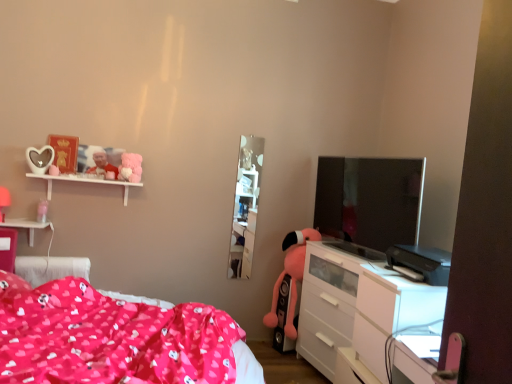
The width and height of the screenshot is (512, 384). What do you see at coordinates (357, 305) in the screenshot?
I see `white glossy chest of drawers at lower right` at bounding box center [357, 305].

Identify the location of pink plush toy at lower center, the 1th toy ordered from the bottom. The width and height of the screenshot is (512, 384). (291, 277).

In order to click on white matte shelf at upper left in this screenshot , I will do `click(85, 182)`.

At what (x,y) coordinates should I click in order to perform the action: click on white glossy tv cabinet at center. Please return your answer as a coordinate pair (x, y). The width and height of the screenshot is (512, 384). Looking at the image, I should click on (246, 206).

What do you see at coordinates (114, 338) in the screenshot?
I see `matte pink fabric bed at lower left` at bounding box center [114, 338].

The height and width of the screenshot is (384, 512). What are the coordinates of `silver glossy tv at right` in the screenshot? It's located at (369, 200).

This screenshot has width=512, height=384. Describe the element at coordinates (369, 200) in the screenshot. I see `silver glossy tv at right` at that location.

You are a GUI agent. You are given a task and a screenshot of the screen. Output one action in this format:
    pyautogui.click(x=<x>, y=<y>)
    Task: Click on the white glossy chest of drawers at lower right
    This screenshot has width=512, height=384.
    Given the screenshot: What is the action you would take?
    (357, 305)

How distant is pink plush toy at lower center, the first toy positioned from the right, from silver glossy tv at right?

pink plush toy at lower center, the first toy positioned from the right, is 26.07 inches away from silver glossy tv at right.

Is pink plush toy at lower center, the first toy positioned from the right, positioned with its back to silver glossy tv at right?

That's not correct — pink plush toy at lower center, the first toy positioned from the right, is not looking away from silver glossy tv at right.

Is the depth of pink plush toy at lower center, which is the third toy in top-to-bottom order, less than that of silver glossy tv at right?

No.

Is pink plush toy at lower center, the first toy positioned from the right, wider or thinner than silver glossy tv at right?

Clearly, pink plush toy at lower center, the first toy positioned from the right, has more width compared to silver glossy tv at right.

Considering the positions of objects white glossy tv cabinet at center and white glossy shelf at upper left in the image provided, who is more to the left, white glossy tv cabinet at center or white glossy shelf at upper left?

white glossy shelf at upper left.

Is white glossy tv cabinet at center smaller than white glossy shelf at upper left?

Yes.

From the image's perspective, relative to white glossy shelf at upper left, is white glossy tv cabinet at center above or below?

white glossy tv cabinet at center is above white glossy shelf at upper left.

From the image's perspective, relative to white matte shelf at upper left, is fluffy pink plush at upper left, which ranks as the 2th toy in top-to-bottom order, above or below?

fluffy pink plush at upper left, which ranks as the 2th toy in top-to-bottom order, is situated higher than white matte shelf at upper left in the image.

Does fluffy pink plush at upper left, which ranks as the 2th toy in left-to-right order, turn towards white matte shelf at upper left?

No.

Can you confirm if fluffy pink plush at upper left, which ranks as the second toy in bottom-to-top order, is wider than white matte shelf at upper left?

In fact, fluffy pink plush at upper left, which ranks as the second toy in bottom-to-top order, might be narrower than white matte shelf at upper left.

Which of these two, fluffy pink plush at upper left, which ranks as the second toy in bottom-to-top order, or white matte shelf at upper left, stands taller?

With more height is fluffy pink plush at upper left, which ranks as the second toy in bottom-to-top order.

Which object is thinner, matte pink fabric bed at lower left or white glossy shelf at upper left?

white glossy shelf at upper left.

Which is behind, point (258, 366) or point (16, 220)?

The point (16, 220) is behind.

Looking at the image, does matte pink fabric bed at lower left seem bigger or smaller compared to white glossy shelf at upper left?

matte pink fabric bed at lower left is bigger than white glossy shelf at upper left.

Is matte pink fabric bed at lower left positioned beyond the bounds of white glossy shelf at upper left?

matte pink fabric bed at lower left is positioned outside white glossy shelf at upper left.

Is matte pink fabric bed at lower left next to fluffy pink plush at upper left, which ranks as the second toy in bottom-to-top order?

matte pink fabric bed at lower left is not next to fluffy pink plush at upper left, which ranks as the second toy in bottom-to-top order, and they're not touching.

Is matte pink fabric bed at lower left positioned beyond the bounds of fluffy pink plush at upper left, which ranks as the 2th toy in left-to-right order?

Yes, matte pink fabric bed at lower left is outside of fluffy pink plush at upper left, which ranks as the 2th toy in left-to-right order.

Can you confirm if matte pink fabric bed at lower left is taller than fluffy pink plush at upper left, which ranks as the second toy in bottom-to-top order?

Yes, matte pink fabric bed at lower left is taller than fluffy pink plush at upper left, which ranks as the second toy in bottom-to-top order.

From a real-world perspective, which object rests below the other?

matte pink fabric bed at lower left.

Which object is positioned more to the left, white glossy shelf at upper left or white matte shelf at upper left?

From the viewer's perspective, white glossy shelf at upper left appears more on the left side.

Does point (28, 225) lie in front of point (28, 175)?

That is False.

Which is behind, white glossy shelf at upper left or white matte shelf at upper left?

white matte shelf at upper left.

Where is `shelf above the silver glossy tv at right (from the image's perspective)`? shelf above the silver glossy tv at right (from the image's perspective) is located at coordinates (85, 182).

Would you say silver glossy tv at right is inside or outside white matte shelf at upper left?

The correct answer is: outside.

From the picture: Measure the distance between silver glossy tv at right and white matte shelf at upper left.

silver glossy tv at right is 1.81 meters from white matte shelf at upper left.

Is point (404, 229) positioned behind point (73, 178)?

That is False.

The height and width of the screenshot is (384, 512). I want to click on the 1st toy to the left of the silver glossy tv at right, counting from the anchor's position, so click(x=291, y=277).

Locate an element on the screen. This screenshot has height=384, width=512. tv cabinet on the right of white glossy shelf at upper left is located at coordinates (246, 206).

When comparing their distances from pink plush toy at lower center, the 1th toy ordered from the bottom, does white glossy chest of drawers at lower right or matte plastic photo frame at upper left, which is counted as the third toy, starting from the bottom, seem further?

matte plastic photo frame at upper left, which is counted as the third toy, starting from the bottom, is positioned further to the anchor pink plush toy at lower center, the 1th toy ordered from the bottom.

Based on their spatial positions, is white matte shelf at upper left or white glossy shelf at upper left further from matte plastic photo frame at upper left, placed as the 1th toy when sorted from top to bottom?

The object further to matte plastic photo frame at upper left, placed as the 1th toy when sorted from top to bottom, is white glossy shelf at upper left.

Which object lies nearer to the anchor point silver glossy tv at right, white matte shelf at upper left or white glossy shelf at upper left?

white matte shelf at upper left lies closer to silver glossy tv at right than the other object.

Which object lies nearer to the anchor point fluffy pink plush at upper left, the second toy positioned from the right, white glossy chest of drawers at lower right or white glossy tv cabinet at center?

white glossy tv cabinet at center is closer to fluffy pink plush at upper left, the second toy positioned from the right.

Estimate the real-world distances between objects in this image. Which object is closer to white glossy tv cabinet at center, matte pink fabric bed at lower left or white glossy chest of drawers at lower right?

Based on the image, white glossy chest of drawers at lower right appears to be nearer to white glossy tv cabinet at center.

Considering their positions, is white matte shelf at upper left positioned closer to white glossy chest of drawers at lower right than white glossy shelf at upper left?

white matte shelf at upper left is positioned closer to the anchor white glossy chest of drawers at lower right.

Estimate the real-world distances between objects in this image. Which object is further from fluffy pink plush at upper left, which ranks as the 2th toy in top-to-bottom order, white glossy tv cabinet at center or white matte shelf at upper left?

Among the two, white glossy tv cabinet at center is located further to fluffy pink plush at upper left, which ranks as the 2th toy in top-to-bottom order.

In the scene shown: Looking at the image, which one is located closer to silver glossy tv at right, white matte shelf at upper left or white glossy chest of drawers at lower right?

white glossy chest of drawers at lower right.

I want to click on tv cabinet between white glossy shelf at upper left and pink plush toy at lower center, which is the third toy in top-to-bottom order, so click(246, 206).

I want to click on shelf situated between white glossy shelf at upper left and pink plush toy at lower center, which is the third toy in top-to-bottom order, from left to right, so click(85, 182).

The height and width of the screenshot is (384, 512). Find the location of `bed between white glossy shelf at upper left and pink plush toy at lower center, positioned as the 3th toy in left-to-right order, from left to right`. bed between white glossy shelf at upper left and pink plush toy at lower center, positioned as the 3th toy in left-to-right order, from left to right is located at coordinates (114, 338).

Locate an element on the screen. This screenshot has width=512, height=384. toy between fluffy pink plush at upper left, which ranks as the 2th toy in left-to-right order, and silver glossy tv at right is located at coordinates (291, 277).